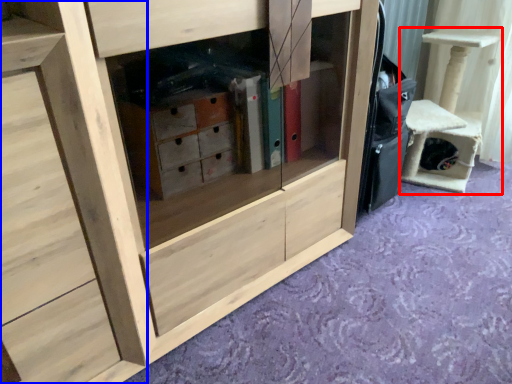
Question: Which object appears closest to the camera in this image, furniture (highlighted by a red box) or chest of drawers (highlighted by a blue box)?

Choices:
 (A) furniture
 (B) chest of drawers

Answer: (B)